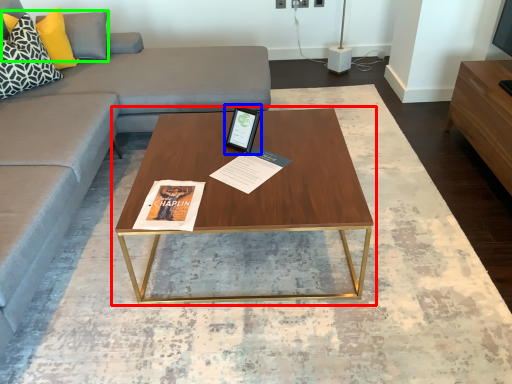
Question: Which is farther away from coffee table (highlighted by a red box)? tablet computer (highlighted by a blue box) or pillow (highlighted by a green box)?

Choices:
 (A) tablet computer
 (B) pillow

Answer: (B)